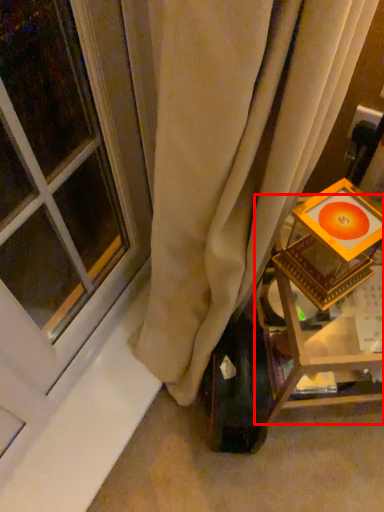
Question: From the image's perspective, considering the relative positions of furniture (annotated by the red box) and window in the image provided, where is furniture (annotated by the red box) located with respect to the staircase?

Choices:
 (A) above
 (B) below

Answer: (B)